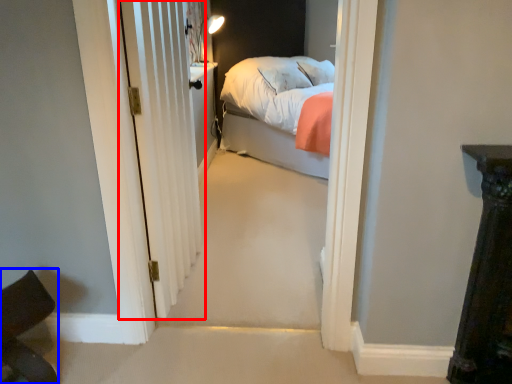
Question: Which point is closer to the camera, door (highlighted by a red box) or chair (highlighted by a blue box)?

Choices:
 (A) door
 (B) chair

Answer: (B)